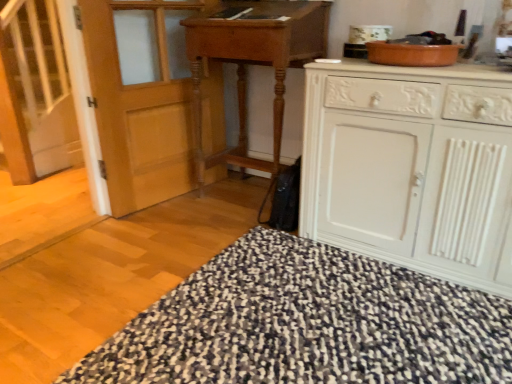
Image resolution: width=512 pixels, height=384 pixels. I want to click on free space on the front side of wooden table at center, so click(211, 237).